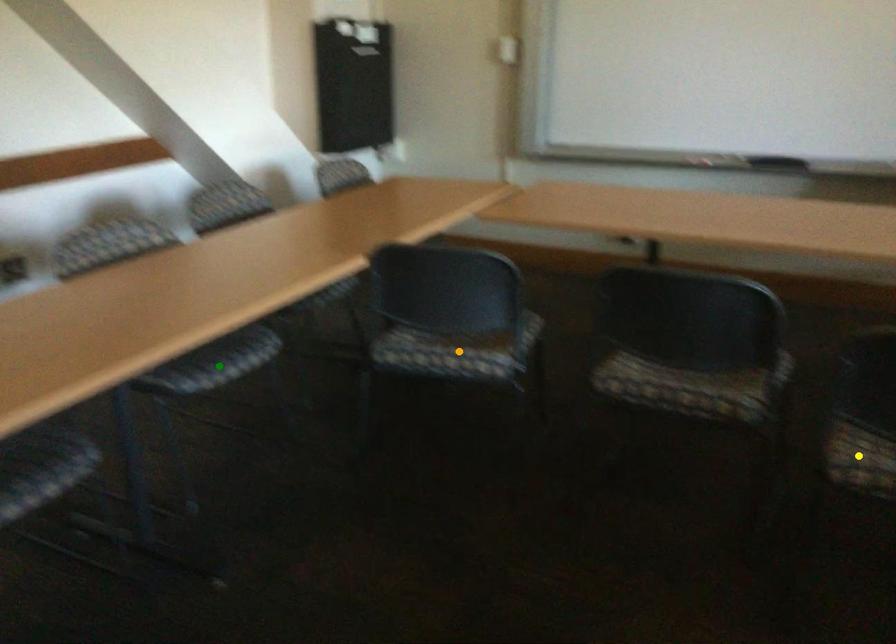
Order these from nearest to farthest:
orange point
green point
yellow point

yellow point → green point → orange point